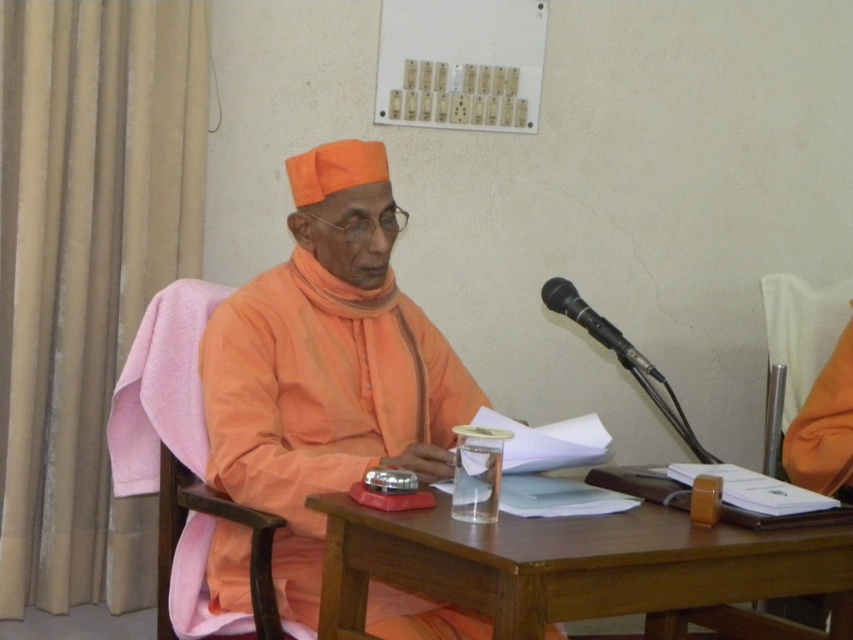
Question: Which point appears farthest from the camera in this image?

Choices:
 (A) (248, 502)
 (B) (833, 372)
 (C) (566, 298)
 (D) (664, 516)

Answer: (B)

Question: Observing the image, what is the correct spatial positioning of matte orange robe at center in reference to brown wooden table at center?

Choices:
 (A) left
 (B) right

Answer: (A)

Question: Is orange fabric chair at right above black metallic microphone at right?

Choices:
 (A) yes
 (B) no

Answer: (B)

Question: Can you confirm if matte orange robe at center is positioned to the right of orange fabric chair at right?

Choices:
 (A) no
 (B) yes

Answer: (A)

Question: Which object appears farthest from the camera in this image?

Choices:
 (A) orange fabric chair at right
 (B) black metallic microphone at right
 (C) matte orange robe at center
 (D) brown wooden table at center

Answer: (A)

Question: Which object is farther from the camera taking this photo?

Choices:
 (A) brown wooden table at center
 (B) orange fabric chair at right
 (C) black metallic microphone at right
 (D) matte orange robe at center

Answer: (B)